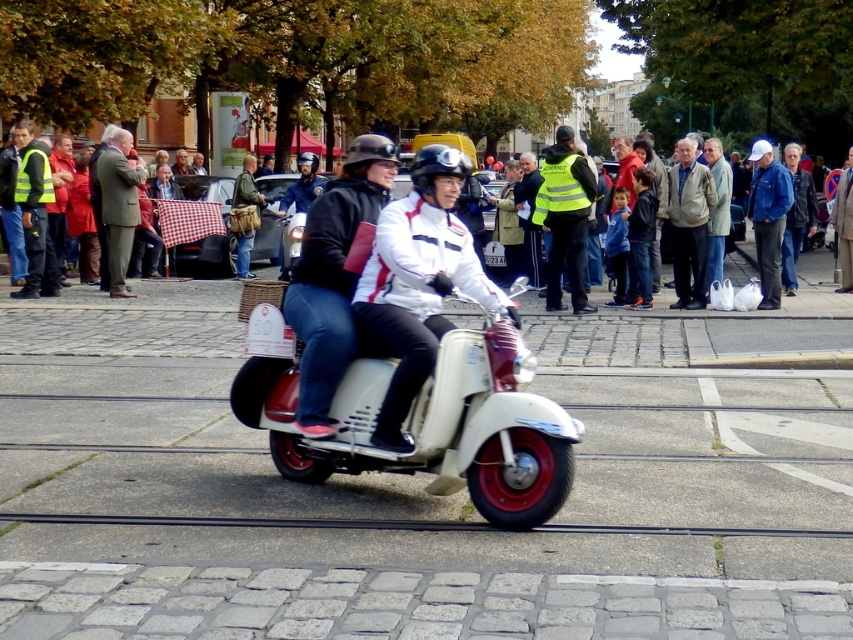
Question: Which of the following is the farthest from the observer?

Choices:
 (A) green wool coat at center
 (B) high-visibility yellow jacket at center
 (C) light gray jacket at center
 (D) white matte jacket at center

Answer: (A)

Question: Can you confirm if white matte jacket at center is wider than matte black helmet at center?

Choices:
 (A) no
 (B) yes

Answer: (B)

Question: Can you confirm if green wool coat at center is thinner than yellow reflective vest at center?

Choices:
 (A) yes
 (B) no

Answer: (B)

Question: Considering the real-world distances, which object is closest to the gray fabric jacket at center?

Choices:
 (A) yellow reflective vest at center
 (B) light gray jacket at center
 (C) high-visibility yellow jacket at center

Answer: (B)

Question: Which of these objects is positioned closest to the matte black helmet at center?

Choices:
 (A) yellow reflective vest at center
 (B) high-visibility yellow jacket at center
 (C) light gray jacket at center
 (D) white matte jacket at center

Answer: (D)

Question: Is green wool coat at center to the left of light gray jacket at center from the viewer's perspective?

Choices:
 (A) yes
 (B) no

Answer: (A)